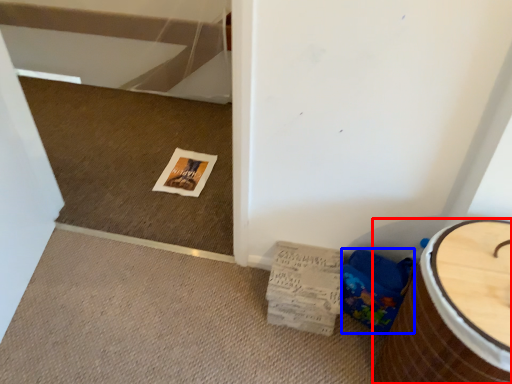
Question: Which object appears farthest to the camera in this image, furniture (highlighted by a red box) or potty (highlighted by a blue box)?

Choices:
 (A) furniture
 (B) potty

Answer: (B)